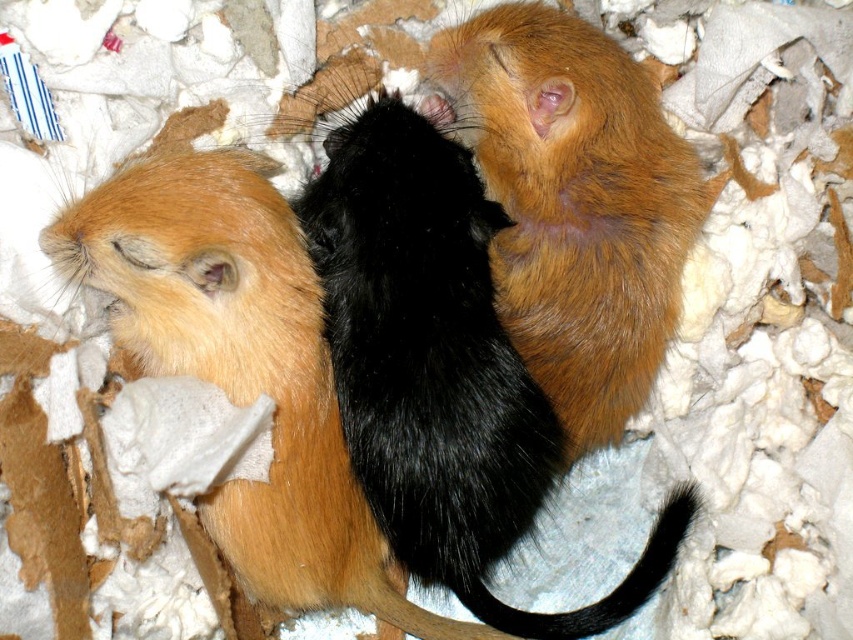
You are a veterinarian examining a gerbil enclosure. You notice the matte black hamster at center and the black silky tail at center. Which one is positioned higher in the image?

The matte black hamster at center is positioned higher than the black silky tail at center.

You are taking a photo of two points marked in the image. The first point is at coordinate point [154,289] and the second is at point [672,496]. Which point will appear larger in your photo?

Point [154,289] is closer to the camera than point [672,496], so it will appear larger in the photo.